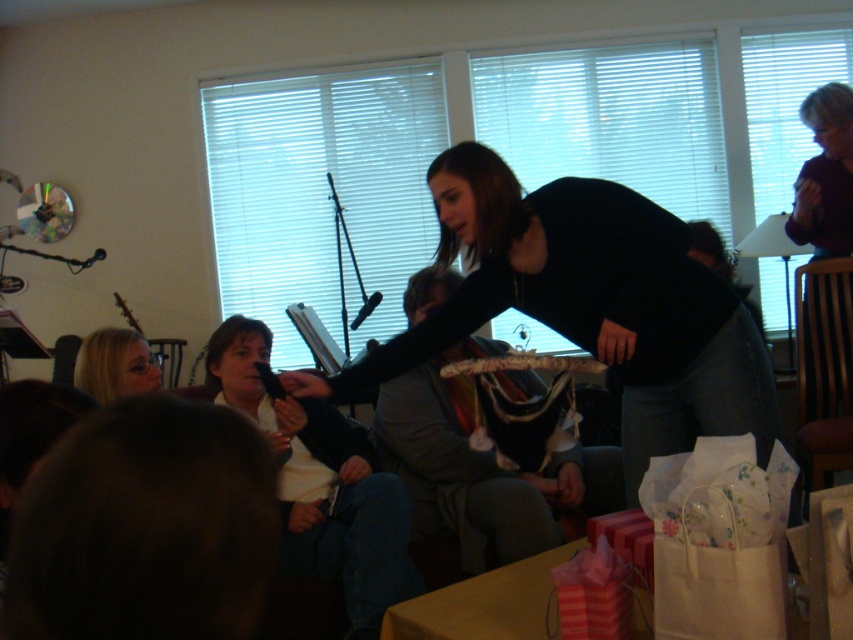
You are at a party and want to know if the gray fabric jacket at center and the white matte shirt at center are close enough to be considered touching. The minimum distance required for two items to be touching is 13 inches. Can you determine if they are touching?

The gray fabric jacket at center is 13.58 inches from the white matte shirt at center. Since 13.58 inches is greater than the 13 inches required for touching, they are not touching.

You are a guest at this event and want to know which item is taller between the gray fabric jacket at center and the white matte shirt at center. Can you determine this?

The gray fabric jacket at center is much taller than the white matte shirt at center.

From the picture: You are standing in the room and want to move from point A to point B. Point A is at coordinate point (253, 392) and point B is at coordinate point (97, 333). Since you can only move forward, will you have to walk towards or away from the table covered with light colored tablecloth to reach point B from point A?

Since point A is further to the viewer than point B, you will have to walk away from the table covered with light colored tablecloth to reach point B from point A.